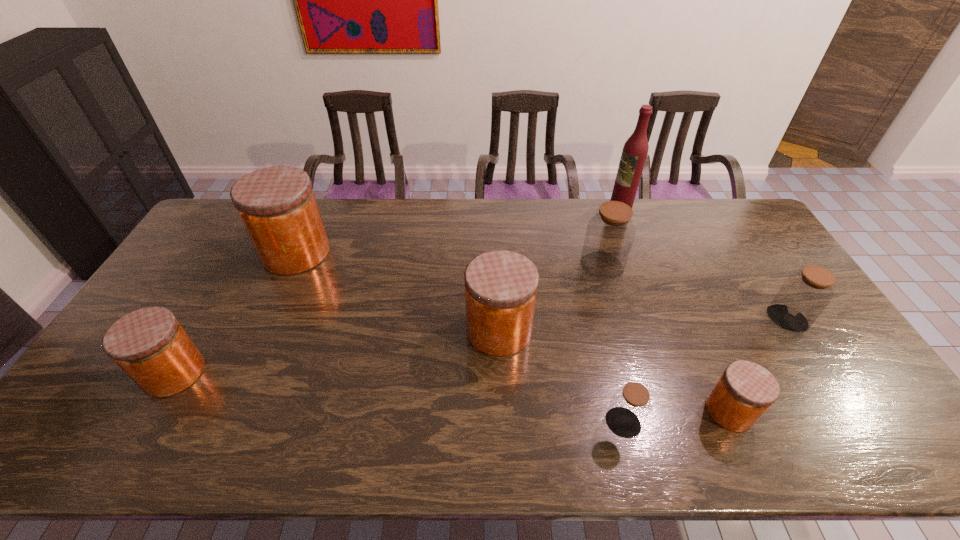
Locate an element on the screen. The image size is (960, 540). vacant space that satisfies the following two spatial constraints: 1. on the front side of the nearest brown jar; 2. on the left side of the fifth jar from right to left is located at coordinates (502, 423).

What are the coordinates of `free space that satisfies the following two spatial constraints: 1. on the front side of the fifth jar from right to left; 2. on the left side of the farthest orange jar` in the screenshot? It's located at (262, 330).